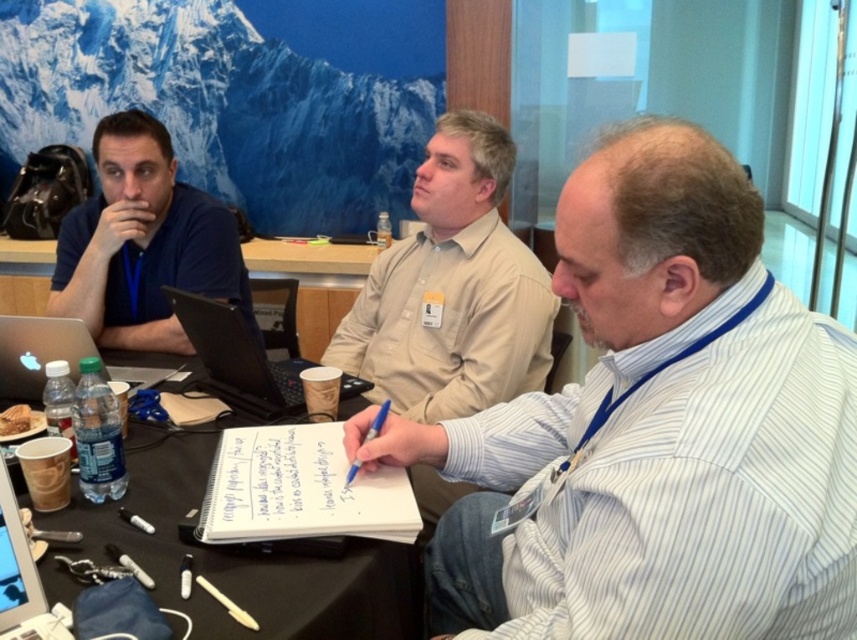
Is white striped shirt at center above beige cotton shirt at center?

Incorrect, white striped shirt at center is not positioned above beige cotton shirt at center.

Can you confirm if white striped shirt at center is taller than beige cotton shirt at center?

No.

Where is `white striped shirt at center`? This screenshot has height=640, width=857. white striped shirt at center is located at coordinates (x=655, y=429).

Where is `white striped shirt at center`? Image resolution: width=857 pixels, height=640 pixels. white striped shirt at center is located at coordinates (655, 429).

Does white striped shirt at center appear on the left side of matte blue shirt at left?

In fact, white striped shirt at center is to the right of matte blue shirt at left.

Is white striped shirt at center thinner than matte blue shirt at left?

No, white striped shirt at center is not thinner than matte blue shirt at left.

Is point (544, 401) positioned before point (222, 282)?

That is True.

Where is `white striped shirt at center`? Image resolution: width=857 pixels, height=640 pixels. white striped shirt at center is located at coordinates (655, 429).

Measure the distance from beige cotton shirt at center to silver metallic laptop at left.

beige cotton shirt at center is 66.35 centimeters away from silver metallic laptop at left.

Is beige cotton shirt at center to the left of silver metallic laptop at left from the viewer's perspective?

Incorrect, beige cotton shirt at center is not on the left side of silver metallic laptop at left.

Between point (399, 397) and point (55, 337), which one is positioned behind?

Positioned behind is point (399, 397).

The width and height of the screenshot is (857, 640). Identify the location of beige cotton shirt at center. pyautogui.click(x=452, y=289).